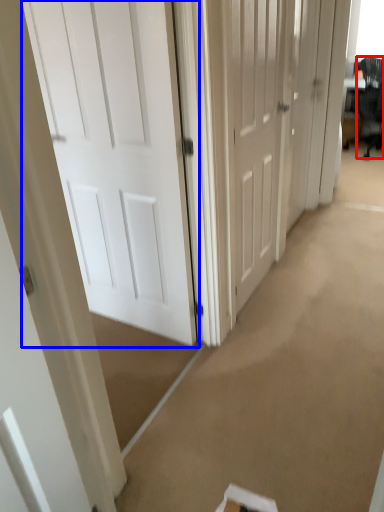
Question: Among these objects, which one is farthest to the camera, swivel chair (highlighted by a red box) or door (highlighted by a blue box)?

Choices:
 (A) swivel chair
 (B) door

Answer: (A)